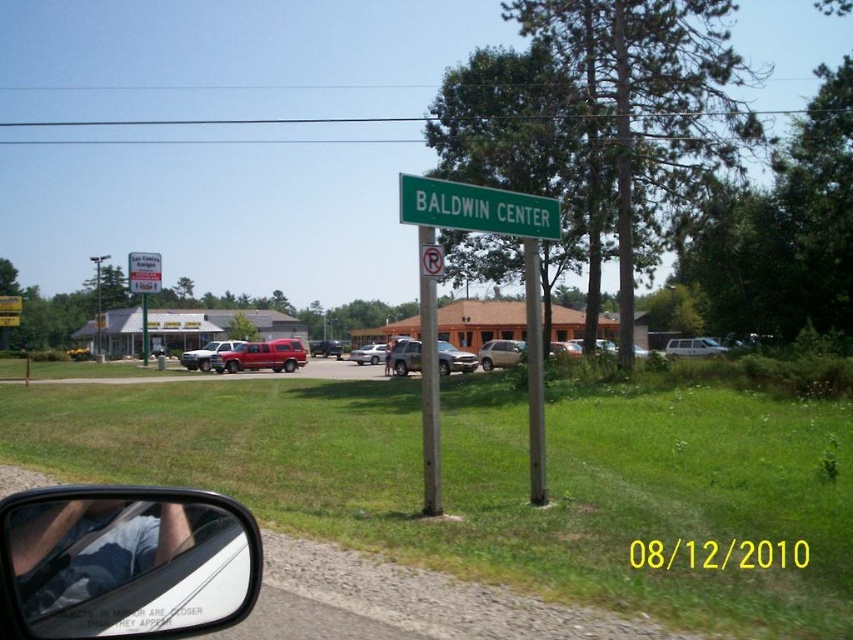
You are a delivery driver who needs to park your truck between the white plastic sign at upper center and the green plastic sign at center. The truck is 20 feet long. Can you park the truck between them without overlapping either sign?

The distance between the white plastic sign at upper center and the green plastic sign at center is 204.00 feet, so yes, the truck can park between them as the space is more than enough to accommodate its 20 feet length.

In the scene shown: You are driving and see the white plastic sign at upper center and the green plastic sign at center. Which one is bigger?

The white plastic sign at upper center is larger in size than the green plastic sign at center.